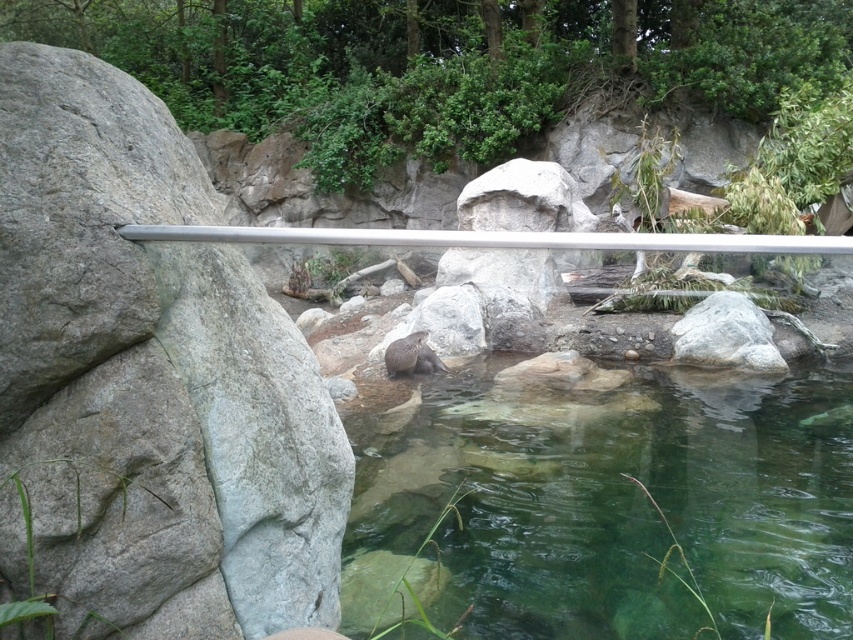
What do you see at coordinates (607, 506) in the screenshot? This screenshot has width=853, height=640. I see `clear glass water at center` at bounding box center [607, 506].

Which is above, clear glass water at center or silver metallic rail at center?

silver metallic rail at center

Based on the photo, who is more distant from viewer, (721, 563) or (364, 241)?

Point (364, 241)

The width and height of the screenshot is (853, 640). I want to click on clear glass water at center, so click(x=607, y=506).

Is gray rock at left to the right of brown furry otter at center from the viewer's perspective?

Incorrect, gray rock at left is not on the right side of brown furry otter at center.

Does gray rock at left have a greater height compared to brown furry otter at center?

Correct, gray rock at left is much taller as brown furry otter at center.

Who is more forward, (329,422) or (404,365)?

Positioned in front is point (329,422).

This screenshot has width=853, height=640. What are the coordinates of `gray rock at left` in the screenshot? It's located at (148, 381).

Is point (91, 465) positioned after point (334, 230)?

No, it is in front of (334, 230).

Is point (57, 90) positioned in front of point (674, 236)?

Yes, point (57, 90) is in front of point (674, 236).

Measure the distance between point (251, 358) and camera.

Point (251, 358) and camera are 7.96 feet apart from each other.

Find the location of a particular element. gray rock at left is located at coordinates (148, 381).